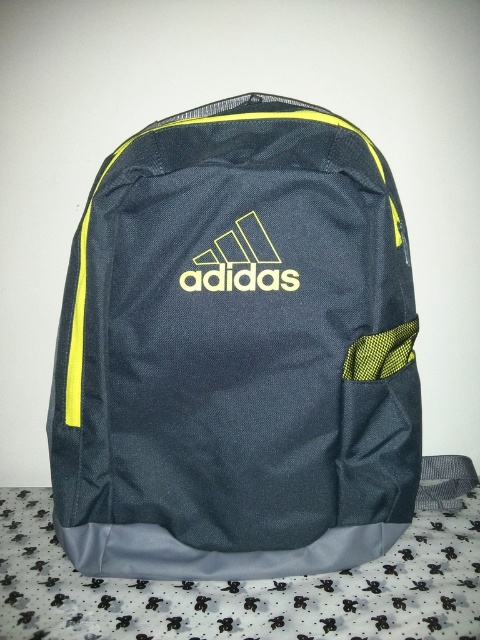
Question: Among these objects, which one is farthest from the camera?

Choices:
 (A) yellow matte logo at center
 (B) dark gray fabric backpack at center

Answer: (A)

Question: Can you confirm if dark gray fabric backpack at center is bigger than yellow matte logo at center?

Choices:
 (A) yes
 (B) no

Answer: (A)

Question: Can you confirm if dark gray fabric backpack at center is thinner than yellow matte logo at center?

Choices:
 (A) yes
 (B) no

Answer: (B)

Question: Which point is closer to the camera taking this photo?

Choices:
 (A) (x=266, y=282)
 (B) (x=204, y=124)

Answer: (B)

Question: Does dark gray fabric backpack at center have a smaller size compared to yellow matte logo at center?

Choices:
 (A) yes
 (B) no

Answer: (B)